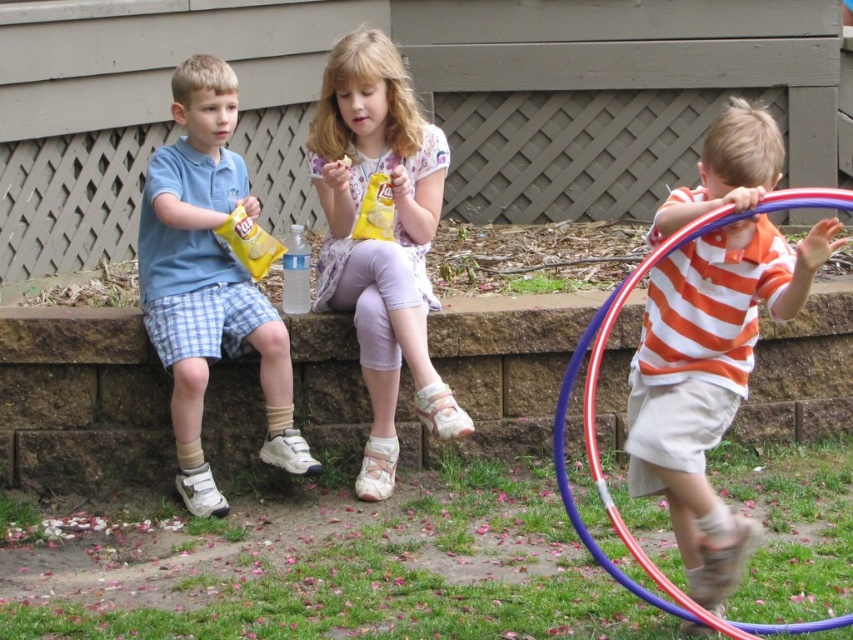
You are a photographer trying to capture a group photo of the matte blue shirt at left and the metallic blue and red hula hoop at right. If you want to ensure both subjects are in focus, which one should you adjust the camera focus to prioritize based on their sizes?

The matte blue shirt at left is smaller in width than the metallic blue and red hula hoop at right, so you should prioritize focusing on the smaller matte blue shirt at left to ensure both are in focus.

You are planning to place a small sticker on the matte yellow snack packet at center and the matte blue shirt at left. Since the sticker is only 2 cm in size, will it fit on both objects?

The matte yellow snack packet at center is bigger than the matte blue shirt at left. Therefore, the sticker will fit on both objects as the yellow snack packet has sufficient space and the blue shirt, though smaller, is still likely large enough for a 2 cm sticker.

You are a parent trying to ensure your children are eating healthy snacks. You see the matte yellow snack packet at center and the matte blue shirt at left. Which item is taller?

The matte yellow snack packet at center is taller than the matte blue shirt at left according to the description.